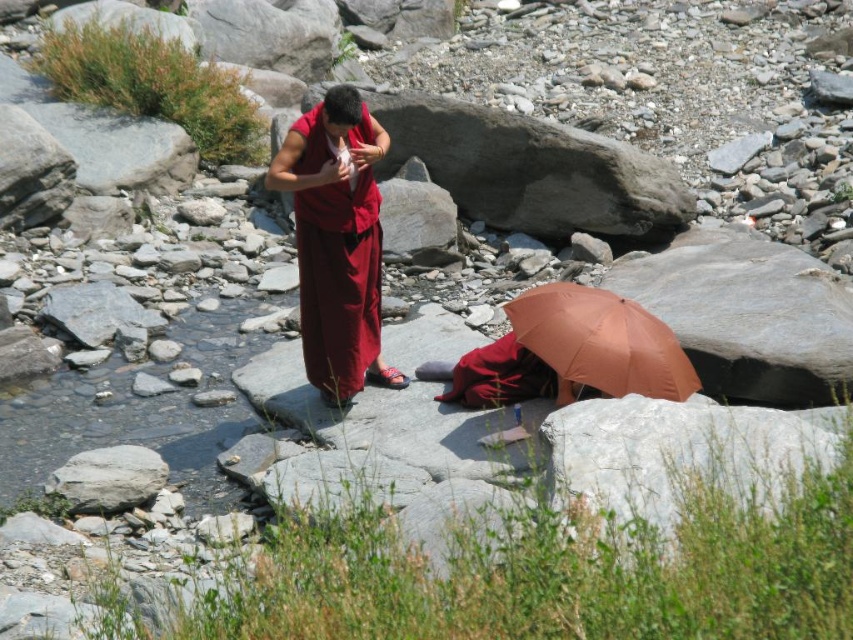
Which is behind, point (299, 129) or point (601, 381)?

Positioned behind is point (299, 129).

Which is above, maroon silk robe at center or orange matte umbrella at lower center?

Positioned higher is maroon silk robe at center.

Where is `maroon silk robe at center`? The image size is (853, 640). maroon silk robe at center is located at coordinates (338, 282).

This screenshot has width=853, height=640. Identify the location of maroon silk robe at center. (338, 282).

Does maroon silk robe at center have a greater width compared to white smooth rock at lower left?

No, maroon silk robe at center is not wider than white smooth rock at lower left.

Is point (308, 307) positioned after point (80, 512)?

Yes, point (308, 307) is farther from viewer.

Find the location of a particular element. The image size is (853, 640). maroon silk robe at center is located at coordinates (338, 282).

Is orange matte umbrella at lower center positioned at the back of white smooth rock at lower left?

No, it is in front of white smooth rock at lower left.

Between orange matte umbrella at lower center and white smooth rock at lower left, which one is positioned lower?

white smooth rock at lower left is below.

This screenshot has width=853, height=640. What do you see at coordinates (601, 342) in the screenshot? I see `orange matte umbrella at lower center` at bounding box center [601, 342].

Identify the location of orange matte umbrella at lower center. (601, 342).